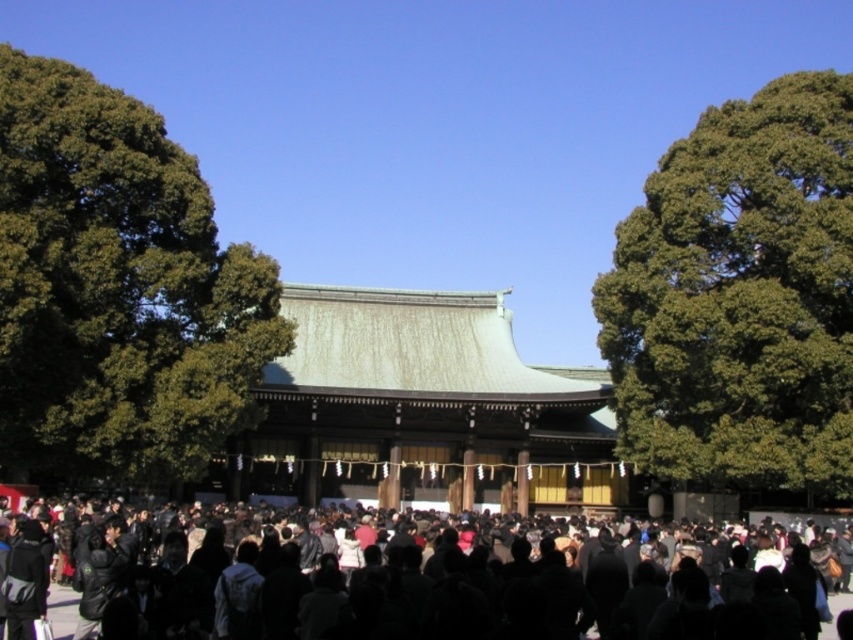
Which is behind, point (115, 220) or point (802, 408)?

The point (115, 220) is more distant.

Does green leafy tree at left have a lesser width compared to green leafy tree at right?

No, green leafy tree at left is not thinner than green leafy tree at right.

Image resolution: width=853 pixels, height=640 pixels. What are the coordinates of `green leafy tree at left` in the screenshot? It's located at (117, 289).

Is green leafy tree at right below black matte crowd at center?

No.

Does point (656, 243) lie in front of point (575, 584)?

No, (656, 243) is behind (575, 584).

Is point (822, 179) farther from viewer compared to point (552, 596)?

Yes, point (822, 179) is behind point (552, 596).

Locate an element on the screen. This screenshot has height=640, width=853. green leafy tree at right is located at coordinates (740, 298).

Does green leafy tree at left have a larger size compared to black matte crowd at center?

Yes, green leafy tree at left is bigger than black matte crowd at center.

Is green leafy tree at left to the right of black matte crowd at center from the viewer's perspective?

Incorrect, green leafy tree at left is not on the right side of black matte crowd at center.

Does point (103, 115) come closer to viewer compared to point (477, 566)?

No, (103, 115) is behind (477, 566).

Locate an element on the screen. The image size is (853, 640). green leafy tree at left is located at coordinates (117, 289).